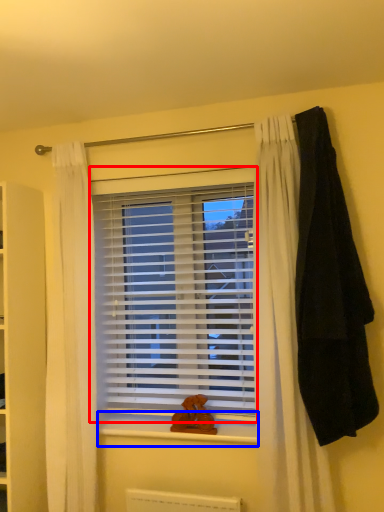
Question: Which point is further to the camera, window blind (highlighted by a red box) or window sill (highlighted by a blue box)?

Choices:
 (A) window blind
 (B) window sill

Answer: (A)